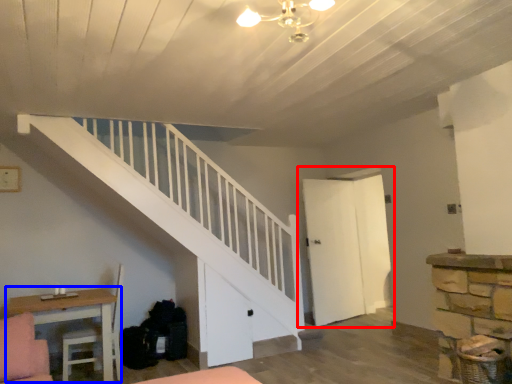
Question: Among these objects, which one is nearest to the camera, door (highlighted by a red box) or table (highlighted by a blue box)?

Choices:
 (A) door
 (B) table

Answer: (B)